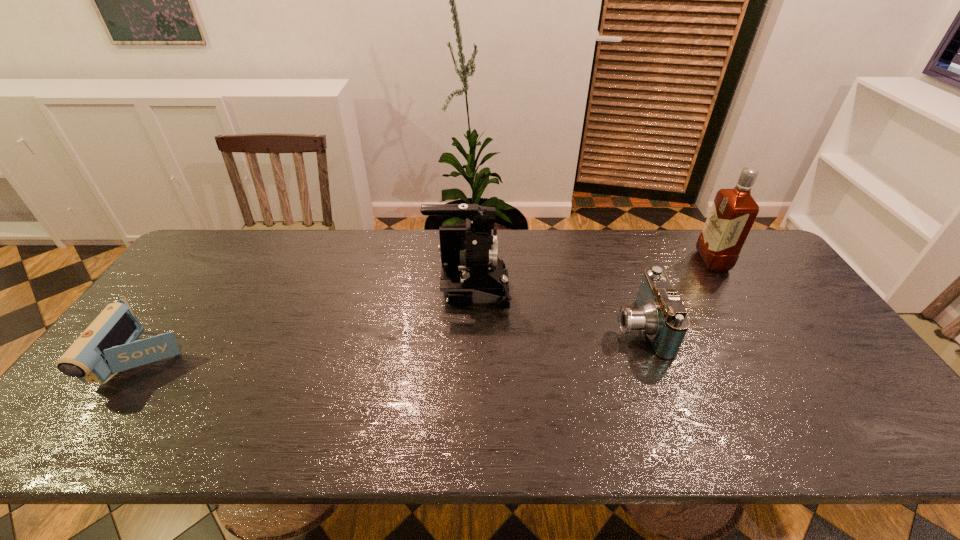
Identify the location of vacant space at the right edge of the desktop. Image resolution: width=960 pixels, height=540 pixels. (827, 407).

Image resolution: width=960 pixels, height=540 pixels. In the image, there is a desktop. In order to click on free space at the far left corner in this screenshot , I will do `click(214, 245)`.

I want to click on vacant area that lies between the second camcorder from left to right and the liquor, so pyautogui.click(x=590, y=275).

You are a GUI agent. You are given a task and a screenshot of the screen. Output one action in this format:
    pyautogui.click(x=<x>, y=<y>)
    Task: Click on the free space between the leftmost camcorder and the rightmost camcorder
    The image size is (960, 540).
    Given the screenshot: What is the action you would take?
    pyautogui.click(x=392, y=343)

Locate an element on the screen. empty space between the leftmost camcorder and the rightmost camcorder is located at coordinates (392, 343).

Where is `vacant area between the second object from left to right and the leftmost object`? Image resolution: width=960 pixels, height=540 pixels. vacant area between the second object from left to right and the leftmost object is located at coordinates (307, 325).

Where is `vacant region between the leftmost object and the second object from right to left`? vacant region between the leftmost object and the second object from right to left is located at coordinates (x=392, y=343).

The height and width of the screenshot is (540, 960). I want to click on free space between the rightmost camcorder and the leftmost camcorder, so click(392, 343).

The width and height of the screenshot is (960, 540). I want to click on free point between the third object from left to right and the leftmost object, so click(392, 343).

Find the location of a particular element. vacant space that's between the second object from right to left and the third object from right to left is located at coordinates (554, 309).